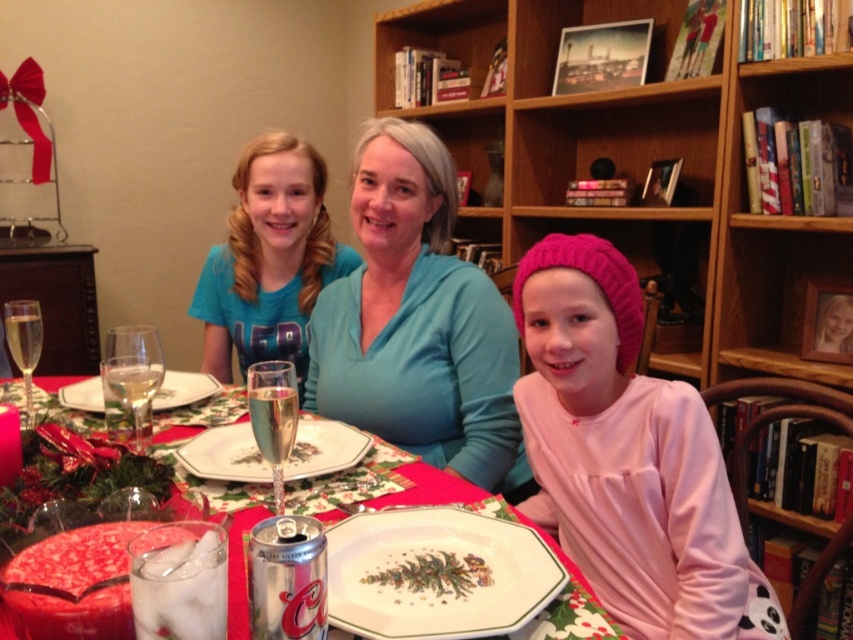
Is point (643, 124) closer to viewer compared to point (311, 438)?

No, (643, 124) is behind (311, 438).

Identify the location of wooden bookshelf at upper center. The image size is (853, 640). (643, 168).

Between wooden bookshelf at upper center and blue cotton shirt at center, which one has more height?

wooden bookshelf at upper center is taller.

Is point (837, 115) positioned in front of point (323, 193)?

Yes, it is.

Locate an element on the screen. The height and width of the screenshot is (640, 853). wooden bookshelf at upper center is located at coordinates (643, 168).

Where is `wooden bookshelf at upper center`? The image size is (853, 640). wooden bookshelf at upper center is located at coordinates (643, 168).

Does teal matte shirt at center have a lesser width compared to porcelain plate with christmas tree design at center?

No, teal matte shirt at center is not thinner than porcelain plate with christmas tree design at center.

Does teal matte shirt at center lie in front of porcelain plate with christmas tree design at center?

No, it is not.

Is point (368, 380) farther from viewer compared to point (469, 524)?

Yes, it is.

Where is `teal matte shirt at center`? Image resolution: width=853 pixels, height=640 pixels. teal matte shirt at center is located at coordinates (416, 321).